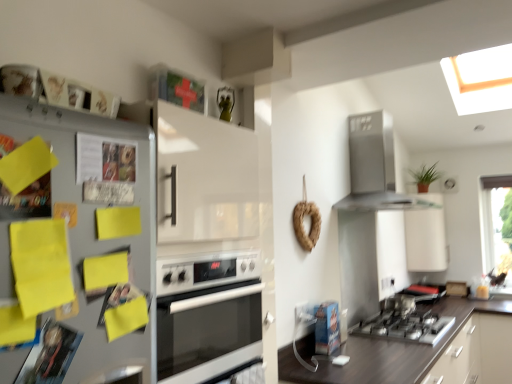
This screenshot has height=384, width=512. What do you see at coordinates (375, 167) in the screenshot? I see `satin silver range hood at upper right` at bounding box center [375, 167].

You are a GUI agent. You are given a task and a screenshot of the screen. Output one action in this format:
    pyautogui.click(x=<x>, y=<y>)
    Task: Click on the satin silver gas stove at lower center
    Image resolution: width=512 pixels, height=384 pixels.
    Given the screenshot: What is the action you would take?
    pyautogui.click(x=406, y=327)

Measure the distance between point (444, 322) and camera.

Point (444, 322) and camera are 9.55 feet apart from each other.

What do you see at coordinates (206, 313) in the screenshot? I see `white glossy oven at center` at bounding box center [206, 313].

The image size is (512, 384). In order to click on white glossy oven at center in this screenshot , I will do `click(206, 313)`.

In order to face dark brown wood at lower right, should I rotate leftwards or rightwards?

Rotate your view right by about 20.850°.

Locate an element on the screen. metallic gray refrigerator at left is located at coordinates (77, 246).

Identify the location of white glossy cabinet at upper right. The height and width of the screenshot is (384, 512). (426, 235).

Measure the distance between point (415, 212) and camera.

They are 4.05 meters apart.

Locate an element on the screen. satin silver range hood at upper right is located at coordinates (375, 167).

Is metallic gray refrigerator at left wider or thinner than white glossy oven at center?

Clearly, metallic gray refrigerator at left has less width compared to white glossy oven at center.

Which object is positioned more to the right, metallic gray refrigerator at left or white glossy oven at center?

white glossy oven at center is more to the right.

Where is `refrigerator that is in front of the white glossy oven at center`? refrigerator that is in front of the white glossy oven at center is located at coordinates (77, 246).

Would you say metallic gray refrigerator at left is a long distance from white glossy oven at center?

No, metallic gray refrigerator at left is not far away from white glossy oven at center.

Between point (378, 130) and point (422, 186), which one is positioned in front?

The point (378, 130) is closer to the camera.

Is satin silver range hood at upper right oriented away from green leafy plant at upper right?

That's not correct — satin silver range hood at upper right is not looking away from green leafy plant at upper right.

Is satin silver range hood at upper right situated inside green leafy plant at upper right or outside?

satin silver range hood at upper right is located beyond the bounds of green leafy plant at upper right.

Looking at the image, does satin silver range hood at upper right seem bigger or smaller compared to green leafy plant at upper right?

In the image, satin silver range hood at upper right appears to be larger than green leafy plant at upper right.

Which is in front, point (418, 182) or point (492, 372)?

The point (492, 372) is more forward.

From a real-world perspective, relative to dark brown wood at lower right, is green leafy plant at upper right vertically above or below?

In terms of real-world spatial position, green leafy plant at upper right is above dark brown wood at lower right.

Where is `countertop located on the left of green leafy plant at upper right`? Image resolution: width=512 pixels, height=384 pixels. countertop located on the left of green leafy plant at upper right is located at coordinates (424, 354).

From the image's perspective, which object appears higher, green leafy plant at upper right or dark brown wood at lower right?

green leafy plant at upper right appears higher in the image.

Considering the positions of point (418, 188) and point (383, 133), is point (418, 188) closer or farther from the camera than point (383, 133)?

Point (418, 188) is positioned farther from the camera compared to point (383, 133).

Are green leafy plant at upper right and satin silver range hood at upper right far apart?

Yes, green leafy plant at upper right is far from satin silver range hood at upper right.

From the image's perspective, which is above, green leafy plant at upper right or satin silver range hood at upper right?

satin silver range hood at upper right appears higher in the image.

I want to click on houseplant that appears on the right of satin silver range hood at upper right, so click(x=425, y=177).

Is metallic gray refrigerator at left positioned far away from transparent glass window at upper right?

Yes.

Would you say metallic gray refrigerator at left is outside transparent glass window at upper right?

metallic gray refrigerator at left is positioned outside transparent glass window at upper right.

Which is more to the left, metallic gray refrigerator at left or transparent glass window at upper right?

Positioned to the left is metallic gray refrigerator at left.

Considering the sizes of objects white glossy cabinet at upper right and satin silver gas stove at lower center in the image provided, who is shorter, white glossy cabinet at upper right or satin silver gas stove at lower center?

satin silver gas stove at lower center is shorter.

In the scene shown: From a real-world perspective, which object rests below the other?

In real-world perspective, satin silver gas stove at lower center is lower.

Does white glossy cabinet at upper right have a greater width compared to satin silver gas stove at lower center?

In fact, white glossy cabinet at upper right might be narrower than satin silver gas stove at lower center.

Is white glossy cabinet at upper right aimed at satin silver gas stove at lower center?

No, white glossy cabinet at upper right is not turned towards satin silver gas stove at lower center.

Does white glossy oven at center touch satin silver range hood at upper right?

No, white glossy oven at center is not next to satin silver range hood at upper right.

Considering the relative sizes of white glossy oven at center and satin silver range hood at upper right in the image provided, is white glossy oven at center wider than satin silver range hood at upper right?

Yes, white glossy oven at center is wider than satin silver range hood at upper right.

Is point (234, 334) closer or farther from the camera than point (366, 143)?

Clearly, point (234, 334) is closer to the camera than point (366, 143).

From their relative heights in the image, would you say white glossy oven at center is taller or shorter than satin silver range hood at upper right?

white glossy oven at center is shorter than satin silver range hood at upper right.

Where is `oven directly beneath the metallic gray refrigerator at left (from a real-world perspective)`? oven directly beneath the metallic gray refrigerator at left (from a real-world perspective) is located at coordinates (206, 313).

I want to click on home appliance to the left of green leafy plant at upper right, so click(x=375, y=167).

Which object lies further to the anchor point satin silver gas stove at lower center, transparent glass window at upper right or white glossy oven at center?

Among the two, transparent glass window at upper right is located further to satin silver gas stove at lower center.

Looking at this image, looking at the image, which one is located closer to white glossy oven at center, green leafy plant at upper right or metallic gray refrigerator at left?

metallic gray refrigerator at left is closer to white glossy oven at center.

Considering their positions, is white glossy oven at center positioned closer to green leafy plant at upper right than metallic gray refrigerator at left?

white glossy oven at center is positioned closer to the anchor green leafy plant at upper right.

Which object lies further to the anchor point satin silver range hood at upper right, white glossy oven at center or white glossy cabinet at upper right?

white glossy oven at center is further to satin silver range hood at upper right.

Estimate the real-world distances between objects in this image. Which object is closer to transparent glass window at upper right, satin silver range hood at upper right or dark brown wood at lower right?

satin silver range hood at upper right is positioned closer to the anchor transparent glass window at upper right.

Consider the image. Considering their positions, is transparent glass window at upper right positioned closer to metallic gray refrigerator at left than white glossy oven at center?

white glossy oven at center is positioned closer to the anchor metallic gray refrigerator at left.

Looking at the image, which one is located closer to satin silver range hood at upper right, transparent glass window at upper right or green leafy plant at upper right?

The object closer to satin silver range hood at upper right is green leafy plant at upper right.

From the image, which object appears to be nearer to white glossy oven at center, dark brown wood at lower right or white glossy cabinet at upper right?

Based on the image, dark brown wood at lower right appears to be nearer to white glossy oven at center.

Image resolution: width=512 pixels, height=384 pixels. I want to click on houseplant located between satin silver range hood at upper right and transparent glass window at upper right in the depth direction, so click(x=425, y=177).

At what (x,y) coordinates should I click in order to perform the action: click on gas stove positioned between metallic gray refrigerator at left and white glossy cabinet at upper right from near to far. Please return your answer as a coordinate pair (x, y). The image size is (512, 384). Looking at the image, I should click on (406, 327).

In order to click on countertop between metallic gray refrigerator at left and green leafy plant at upper right along the z-axis in this screenshot , I will do `click(424, 354)`.

The height and width of the screenshot is (384, 512). I want to click on gas stove between metallic gray refrigerator at left and green leafy plant at upper right from front to back, so click(x=406, y=327).